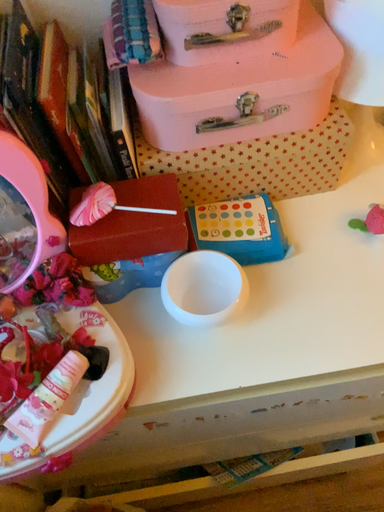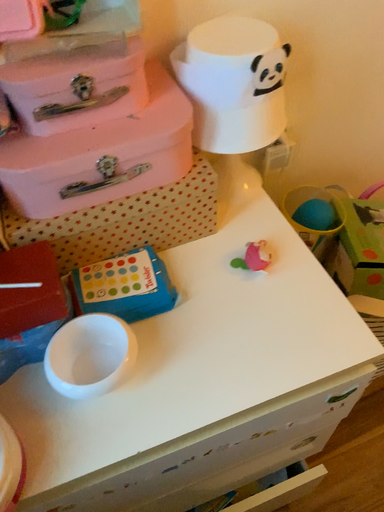
Question: Which way did the camera rotate in the video?

Choices:
 (A) rotated downward
 (B) rotated upward

Answer: (B)